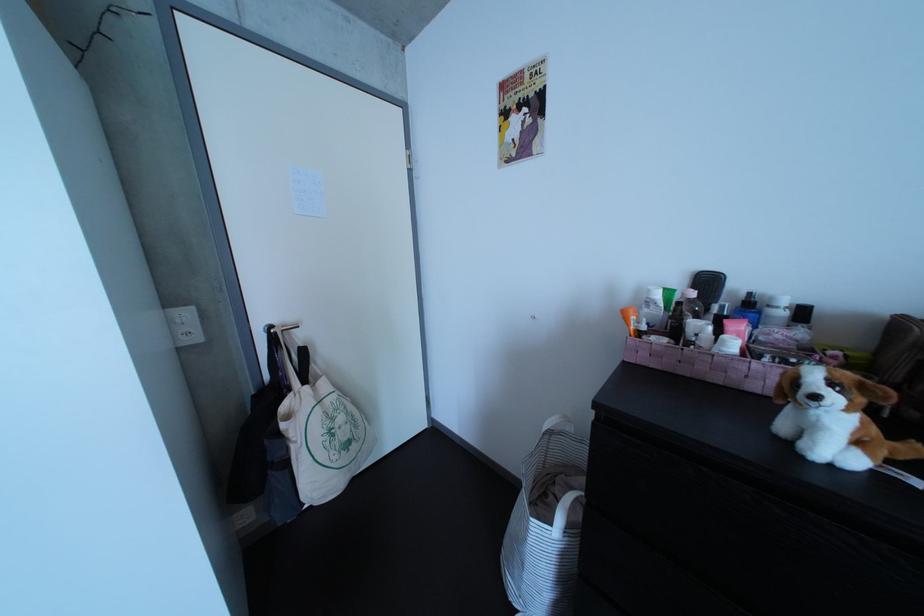
At what (x,y) coordinates should I click in order to perform the action: click on metal door handle. Please return your answer as a coordinate pair (x, y). Image resolution: width=924 pixels, height=616 pixels. Looking at the image, I should click on (286, 326).